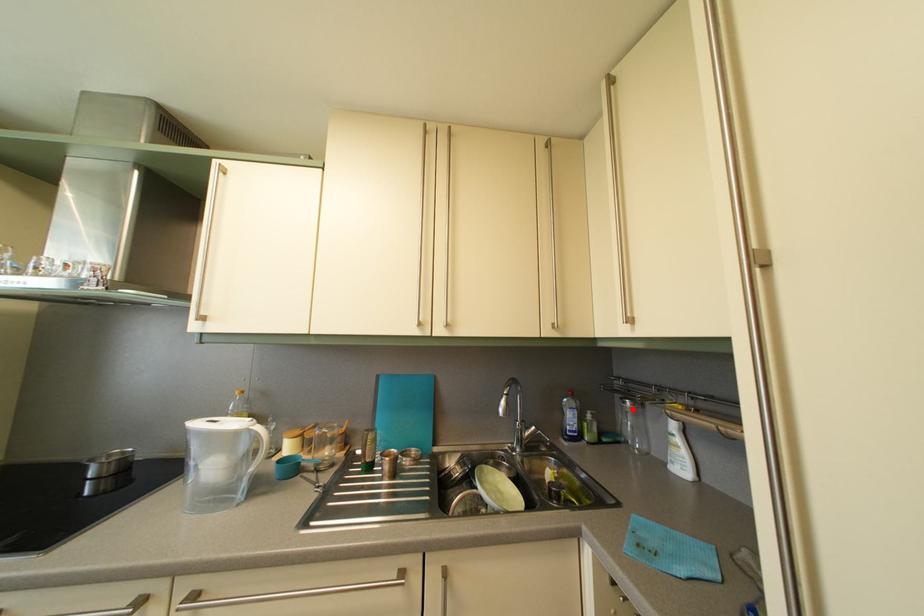
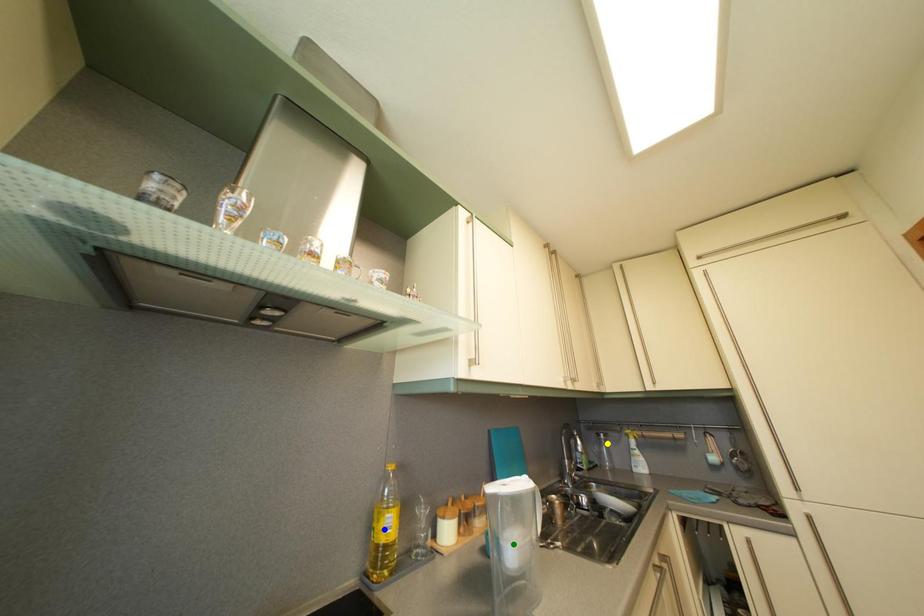
Question: I am providing you with two images of the same scene from different viewpoints. A red point is marked on the first image. You are given multiple points on the second image. Which point in image 2 represents the same 3d spot as the red point in image 1?

Choices:
 (A) green point
 (B) blue point
 (C) yellow point

Answer: (C)